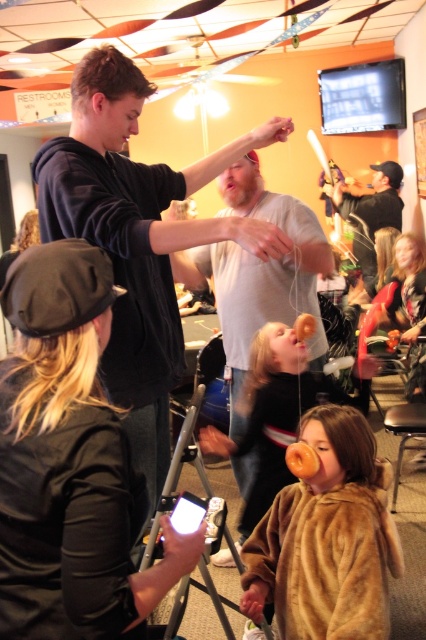
You are organizing a costume party and need to arrange two outfits based on their widths. Given the brown furry coat at lower center and the matte black shirt at center, which one should you place on the narrower rack?

The brown furry coat at lower center has a lesser width compared to the matte black shirt at center, so it should be placed on the narrower rack.